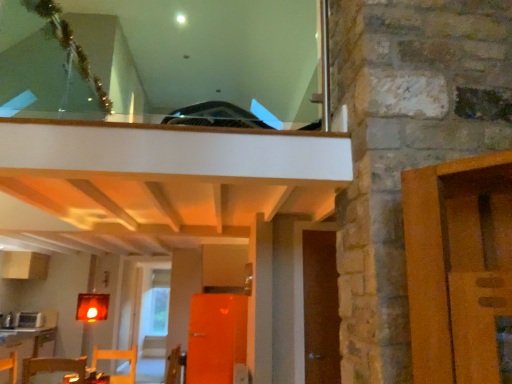
Question: Could you tell me if wooden chair at lower left is facing white glossy microwave at lower left?

Choices:
 (A) no
 (B) yes

Answer: (A)

Question: From the image's perspective, would you say wooden chair at lower left is shown under white glossy microwave at lower left?

Choices:
 (A) no
 (B) yes

Answer: (A)

Question: Is wooden chair at lower left thinner than white glossy microwave at lower left?

Choices:
 (A) no
 (B) yes

Answer: (A)

Question: Could white glossy microwave at lower left be considered to be inside wooden chair at lower left?

Choices:
 (A) no
 (B) yes

Answer: (A)

Question: Can we say wooden chair at lower left lies outside white glossy microwave at lower left?

Choices:
 (A) yes
 (B) no

Answer: (A)

Question: Does point (124, 375) appear closer or farther from the camera than point (321, 382)?

Choices:
 (A) closer
 (B) farther

Answer: (B)

Question: From the image's perspective, is wooden chair at lower left positioned above or below brown wooden door at right?

Choices:
 (A) above
 (B) below

Answer: (B)

Question: Relative to brown wooden door at right, is wooden chair at lower left in front or behind?

Choices:
 (A) front
 (B) behind

Answer: (B)

Question: In terms of width, does wooden chair at lower left look wider or thinner when compared to brown wooden door at right?

Choices:
 (A) thin
 (B) wide

Answer: (B)

Question: Is wooden table at lower left, placed as the first table when sorted from back to front, spatially inside wooden table at lower left, placed as the 1th table when sorted from front to back, or outside of it?

Choices:
 (A) outside
 (B) inside

Answer: (A)

Question: Does point (53, 337) appear closer or farther from the camera than point (108, 380)?

Choices:
 (A) closer
 (B) farther

Answer: (B)

Question: Considering the positions of wooden table at lower left, the second table positioned from the front, and wooden table at lower left, placed as the 1th table when sorted from front to back, in the image, is wooden table at lower left, the second table positioned from the front, wider or thinner than wooden table at lower left, placed as the 1th table when sorted from front to back,?

Choices:
 (A) wide
 (B) thin

Answer: (A)

Question: Considering their positions, is wooden table at lower left, the first table when ordered from bottom to top, located in front of or behind wooden table at lower left, the second table in the bottom-to-top sequence?

Choices:
 (A) front
 (B) behind

Answer: (B)

Question: Considering the positions of wooden table at lower left, which is the 1th table in left-to-right order, and wooden chair at lower left in the image, is wooden table at lower left, which is the 1th table in left-to-right order, taller or shorter than wooden chair at lower left?

Choices:
 (A) short
 (B) tall

Answer: (B)

Question: From a real-world perspective, relative to wooden chair at lower left, is wooden table at lower left, the second table positioned from the front, vertically above or below?

Choices:
 (A) above
 (B) below

Answer: (B)